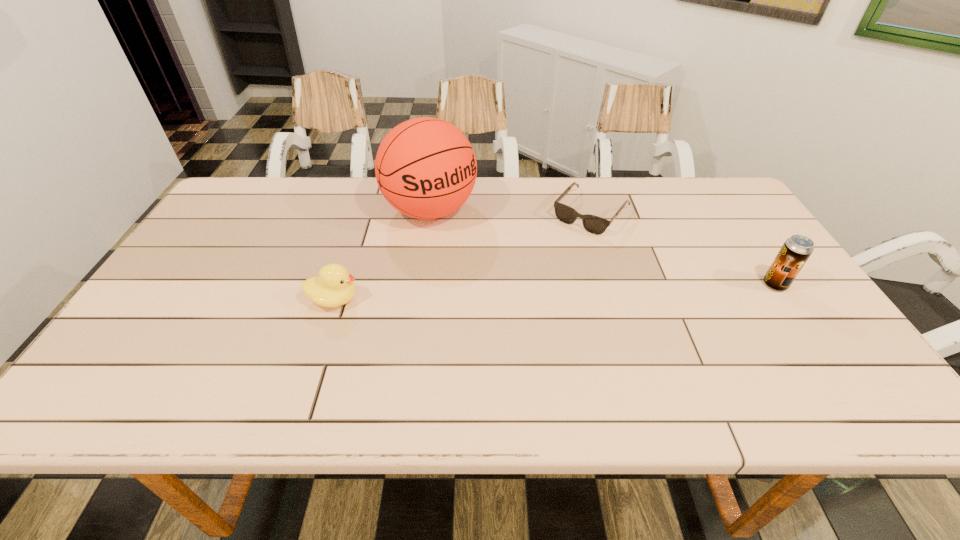
Find the location of `vacant region at the right edge of the desktop`. vacant region at the right edge of the desktop is located at coordinates click(803, 311).

At what (x,y) coordinates should I click in order to perform the action: click on free point at the near left corner. Please return your answer as a coordinate pair (x, y). The image size is (960, 540). Looking at the image, I should click on (184, 347).

This screenshot has height=540, width=960. I want to click on blank space at the far right corner of the desktop, so click(712, 219).

Where is `free space between the tallest object and the third tallest object`? The image size is (960, 540). free space between the tallest object and the third tallest object is located at coordinates 382,255.

I want to click on vacant space that's between the third object from left to right and the basketball, so [511, 212].

Where is `vacant area between the rightmost object and the duckling`? The image size is (960, 540). vacant area between the rightmost object and the duckling is located at coordinates (555, 292).

Locate an element on the screen. free space between the tallest object and the rightmost object is located at coordinates (603, 248).

Find the location of a particular element. The width and height of the screenshot is (960, 540). vacant space that's between the basketball and the second shortest object is located at coordinates coord(382,255).

The height and width of the screenshot is (540, 960). I want to click on vacant space in between the third shortest object and the third object from left to right, so [683, 249].

Find the location of a particular element. The image size is (960, 540). vacant area that lies between the third object from left to right and the beer can is located at coordinates (683, 249).